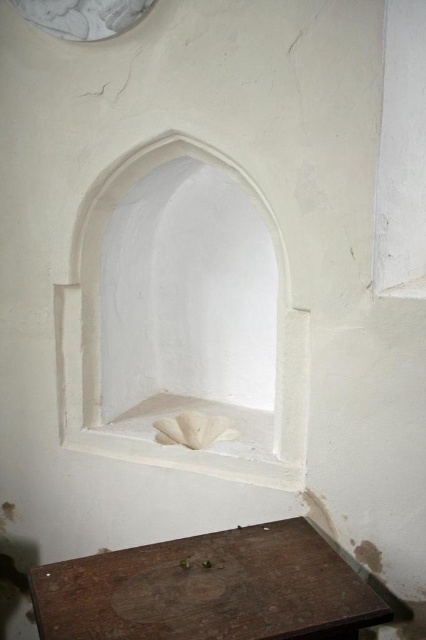
You are standing in a room with a wooden table at lower right and a white smooth stone niche at center. If you want to place a small sculpture on the surface nearest to you, where should you put it?

The wooden table at lower right is below the white smooth stone niche at center, so the surface nearest to you is the wooden table at lower right. Place the sculpture there.

You are standing in a room with a recessed alcove featuring a pointed arch. You notice a small light colored object resembling a seashell inside the alcove. There is also a wooden table at lower right. Can you determine if the point at coordinates point (210, 589) is on the wooden table at lower right?

The point (210, 589) is on wooden table at lower right according to the description.